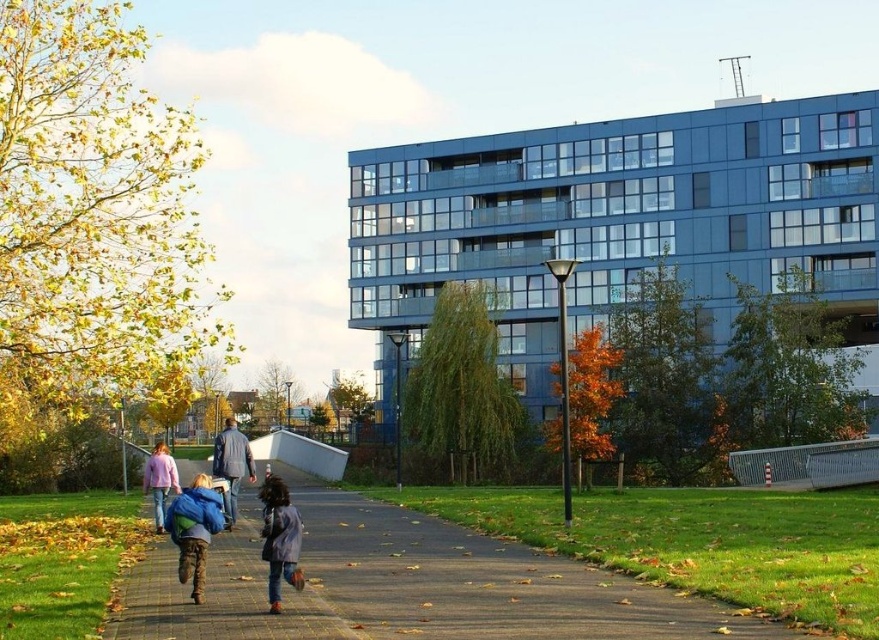
Question: Estimate the real-world distances between objects in this image. Which object is closer to the pink fabric jacket at center?

Choices:
 (A) denim jacket at center
 (B) blue fleece jacket at lower left
 (C) blue denim jacket at center
 (D) smooth asphalt path at center

Answer: (A)

Question: Which point is farther to the camera?

Choices:
 (A) (206, 520)
 (B) (218, 472)
 (C) (144, 468)
 (D) (267, 493)

Answer: (C)

Question: Considering the relative positions of blue denim jacket at center and denim jacket at center in the image provided, where is blue denim jacket at center located with respect to denim jacket at center?

Choices:
 (A) left
 (B) right

Answer: (B)

Question: Can you confirm if blue denim jacket at center is positioned to the right of pink fabric jacket at center?

Choices:
 (A) yes
 (B) no

Answer: (A)

Question: Is brown brick pavement at lower left to the left of denim jacket at center from the viewer's perspective?

Choices:
 (A) yes
 (B) no

Answer: (B)

Question: Among these objects, which one is farthest from the camera?

Choices:
 (A) smooth asphalt path at center
 (B) denim jacket at center
 (C) blue denim jacket at center

Answer: (B)